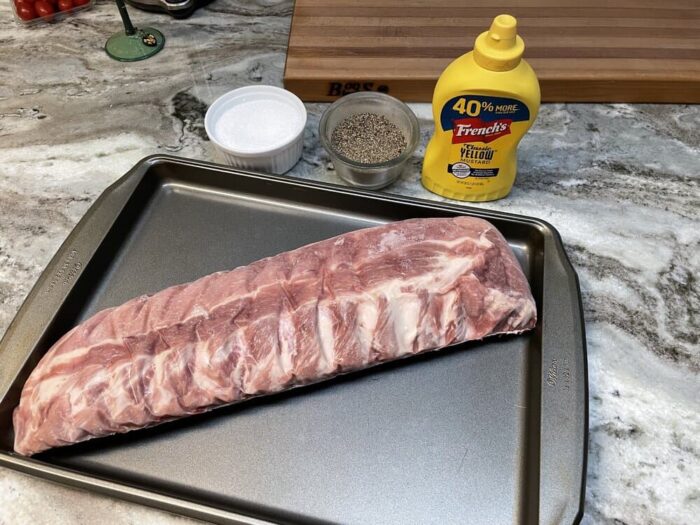
Where is `cooking tray handles`? cooking tray handles is located at coordinates (561, 378), (47, 288).